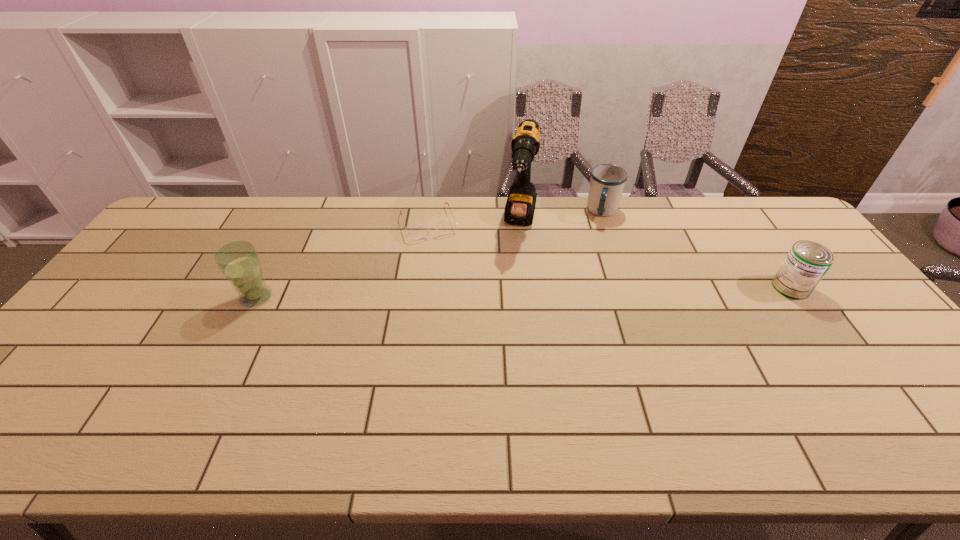
Where is `free space on the desktop that is between the glass and the can and is positioned on the front-facing side of the spectacles`? The width and height of the screenshot is (960, 540). free space on the desktop that is between the glass and the can and is positioned on the front-facing side of the spectacles is located at coordinates (455, 294).

Find the location of a particular element. free space on the desktop that is between the leftmost object and the rightmost object and is positioned on the handle side of the mug is located at coordinates (594, 291).

What are the coordinates of `vacant spot on the desktop that is between the leftmost object and the rightmost object and is positioned at the tip of the drill` in the screenshot? It's located at click(x=512, y=293).